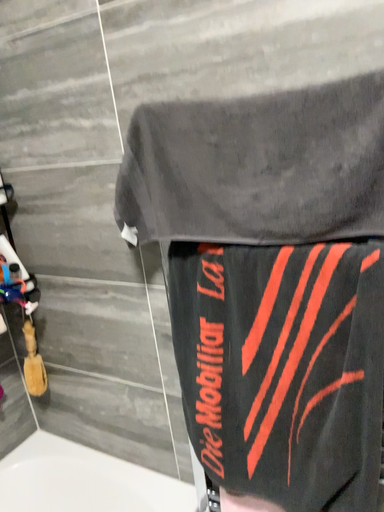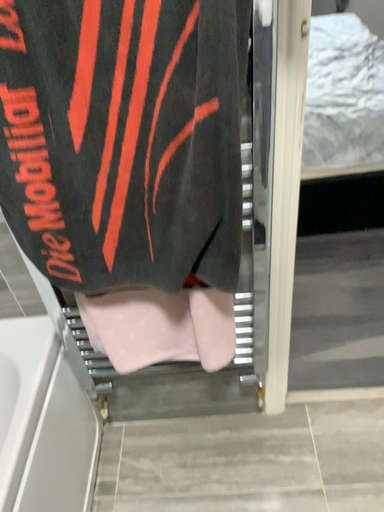
Question: How did the camera likely rotate when shooting the video?

Choices:
 (A) rotated upward
 (B) rotated downward

Answer: (B)